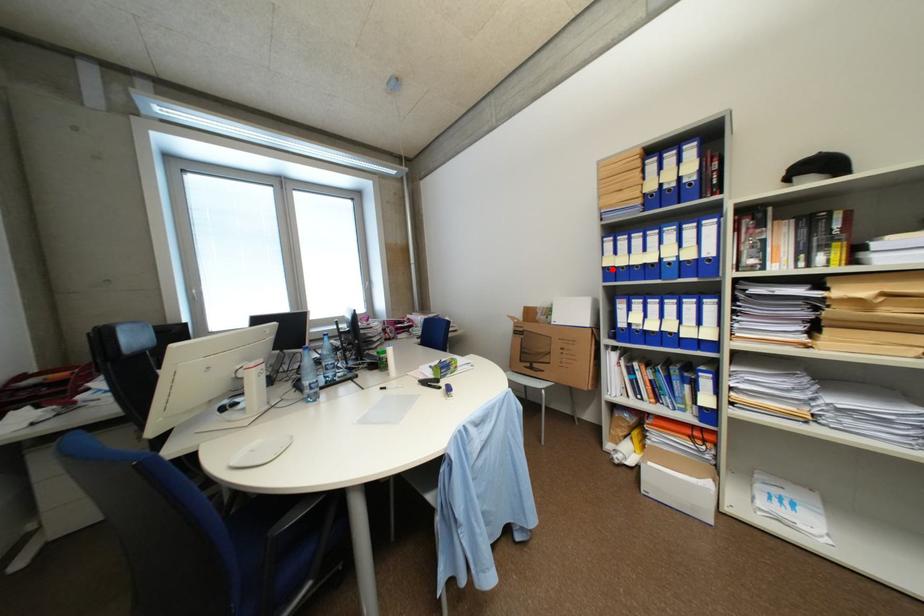
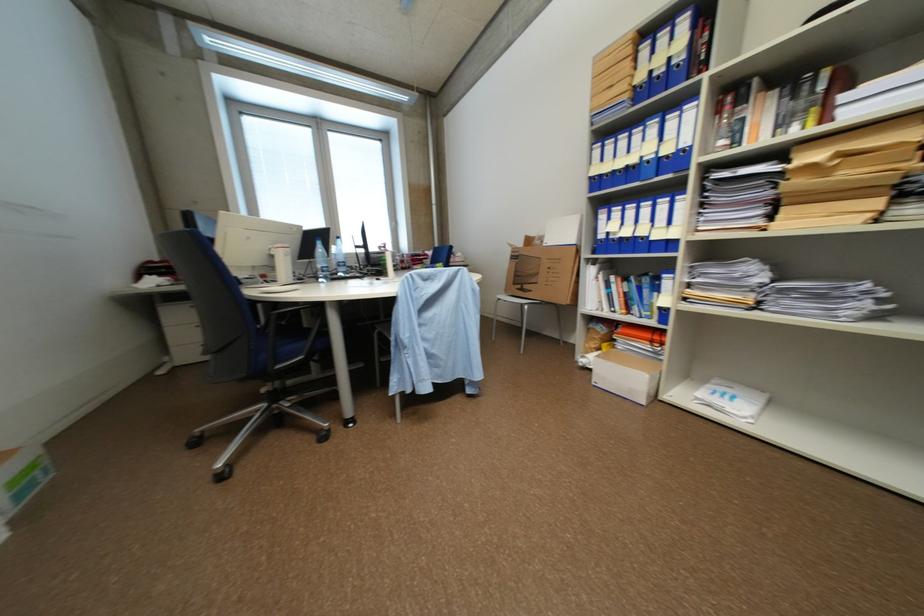
Locate, in the second image, the point that corresponds to the highlighted location in the first image.

(600, 180)